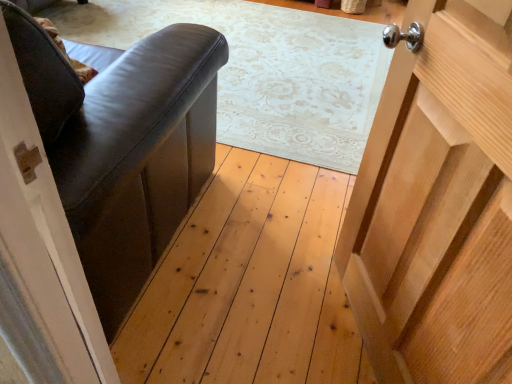
What is the approximate height of wooden door at right?

wooden door at right is 3.30 feet in height.

You are a GUI agent. You are given a task and a screenshot of the screen. Output one action in this format:
    pyautogui.click(x=<x>, y=<y>)
    Task: Click on the wooden door at right
    The height and width of the screenshot is (384, 512).
    Given the screenshot: What is the action you would take?
    pyautogui.click(x=438, y=204)

Describe the element at coordinates (438, 204) in the screenshot. This screenshot has width=512, height=384. I see `wooden door at right` at that location.

Describe the element at coordinates (125, 146) in the screenshot. I see `matte black leather armchair at left` at that location.

At what (x,y) coordinates should I click in order to perform the action: click on matte black leather armchair at left. Please return your answer as a coordinate pair (x, y). The height and width of the screenshot is (384, 512). Looking at the image, I should click on (x=125, y=146).

The image size is (512, 384). Find the location of `wooden door at right`. wooden door at right is located at coordinates (438, 204).

Is matte black leather armchair at left at the left side of wooden door at right?

Yes, matte black leather armchair at left is to the left of wooden door at right.

Between matte black leather armchair at left and wooden door at right, which one is positioned behind?

Positioned behind is matte black leather armchair at left.

Which is in front, point (186, 196) or point (441, 128)?

The point (441, 128) is closer.

From the image's perspective, is matte black leather armchair at left beneath wooden door at right?

No, from the image's perspective, matte black leather armchair at left is not below wooden door at right.

From a real-world perspective, is matte black leather armchair at left on top of wooden door at right?

No, from a real-world perspective, matte black leather armchair at left is not above wooden door at right.

Looking at their sizes, would you say matte black leather armchair at left is wider or thinner than wooden door at right?

Clearly, matte black leather armchair at left has more width compared to wooden door at right.

Can you confirm if matte black leather armchair at left is shorter than wooden door at right?

Indeed, matte black leather armchair at left has a lesser height compared to wooden door at right.

Based on their sizes in the image, would you say matte black leather armchair at left is bigger or smaller than wooden door at right?

Clearly, matte black leather armchair at left is larger in size than wooden door at right.

Do you think matte black leather armchair at left is within wooden door at right, or outside of it?

matte black leather armchair at left is not inside wooden door at right, it's outside.

Is matte black leather armchair at left touching wooden door at right?

They are not placed beside each other.

Looking at this image, is matte black leather armchair at left oriented away from wooden door at right?

No.

From the picture: What's the angular difference between matte black leather armchair at left and wooden door at right's facing directions?

The facing directions of matte black leather armchair at left and wooden door at right are 66 degrees apart.

How much distance is there between matte black leather armchair at left and wooden door at right?

A distance of 25.92 inches exists between matte black leather armchair at left and wooden door at right.

This screenshot has height=384, width=512. I want to click on door that is on the right side of matte black leather armchair at left, so click(438, 204).

Consider the image. In the image, is wooden door at right on the left side or the right side of matte black leather armchair at left?

Clearly, wooden door at right is on the right of matte black leather armchair at left in the image.

Who is more distant, wooden door at right or matte black leather armchair at left?

matte black leather armchair at left is further from the camera.

Which is less distant, (444, 9) or (190, 129)?

Clearly, point (444, 9) is closer to the camera than point (190, 129).

From the image's perspective, would you say wooden door at right is shown under matte black leather armchair at left?

Yes, from the image's perspective, wooden door at right is beneath matte black leather armchair at left.

From a real-world perspective, relative to matte black leather armchair at left, is wooden door at right vertically above or below?

wooden door at right is above matte black leather armchair at left.

Considering the sizes of objects wooden door at right and matte black leather armchair at left in the image provided, who is thinner, wooden door at right or matte black leather armchair at left?

Thinner between the two is wooden door at right.

Between wooden door at right and matte black leather armchair at left, which one has more height?

Standing taller between the two is wooden door at right.

Can you confirm if wooden door at right is bigger than matte black leather armchair at left?

Actually, wooden door at right might be smaller than matte black leather armchair at left.

Which is correct: wooden door at right is inside matte black leather armchair at left, or outside of it?

wooden door at right exists outside the volume of matte black leather armchair at left.

Are wooden door at right and matte black leather armchair at left located far from each other?

That's not correct — wooden door at right is a little close to matte black leather armchair at left.

Is wooden door at right looking in the opposite direction of matte black leather armchair at left?

wooden door at right is not turned away from matte black leather armchair at left.

Measure the distance from wooden door at right to matte black leather armchair at left.

A distance of 25.92 inches exists between wooden door at right and matte black leather armchair at left.

You are a GUI agent. You are given a task and a screenshot of the screen. Output one action in this format:
    pyautogui.click(x=<x>, y=<y>)
    Task: Click on the furniture on the left of the wooden door at right
    
    Given the screenshot: What is the action you would take?
    pyautogui.click(x=125, y=146)

Image resolution: width=512 pixels, height=384 pixels. I want to click on furniture that is behind the wooden door at right, so click(x=125, y=146).

In order to click on door on the right of matte black leather armchair at left in this screenshot , I will do `click(438, 204)`.